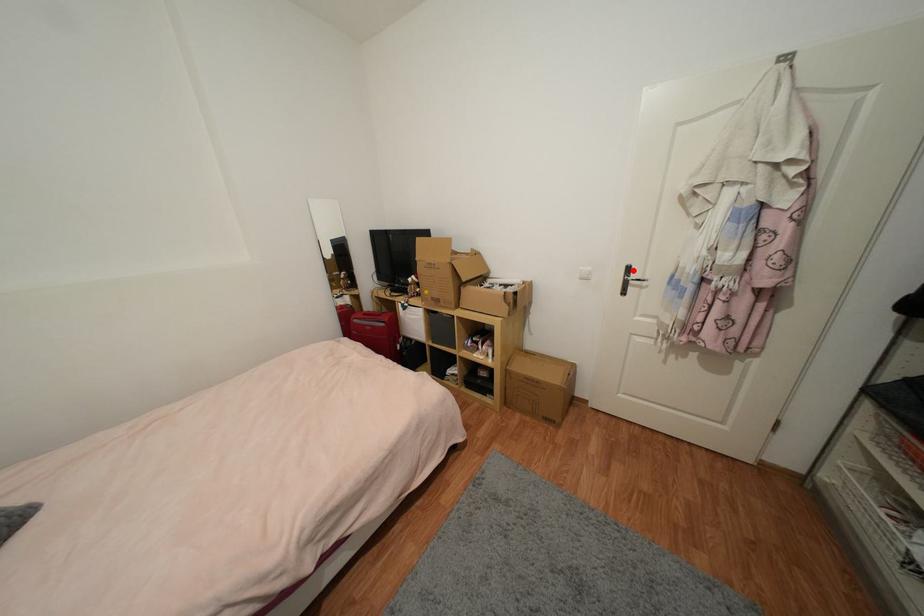
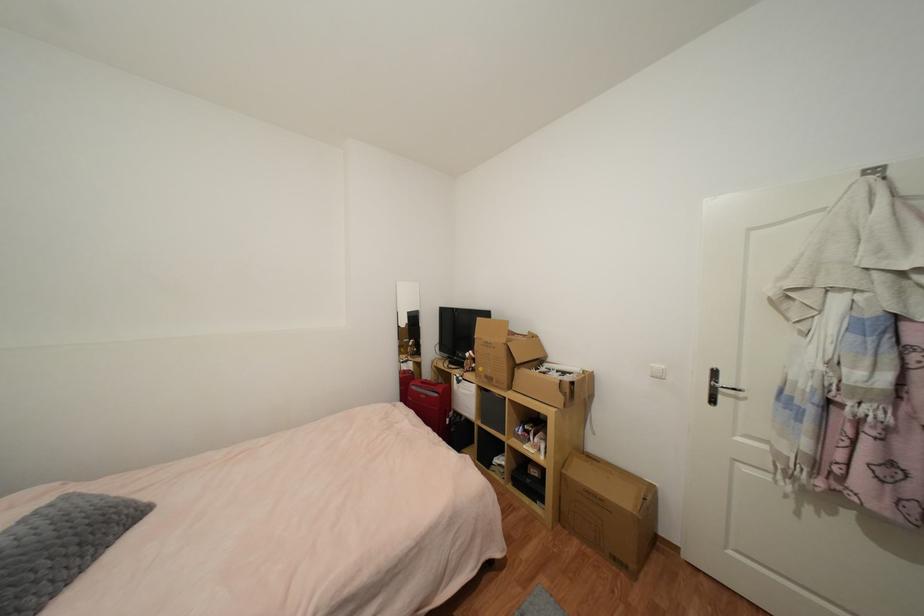
Question: I am providing you with two images of the same scene from different viewpoints. A red point is shown in image1. For the corresponding object point in image2, is it positioned nearer or farther from the camera?

Choices:
 (A) Nearer
 (B) Farther

Answer: (B)